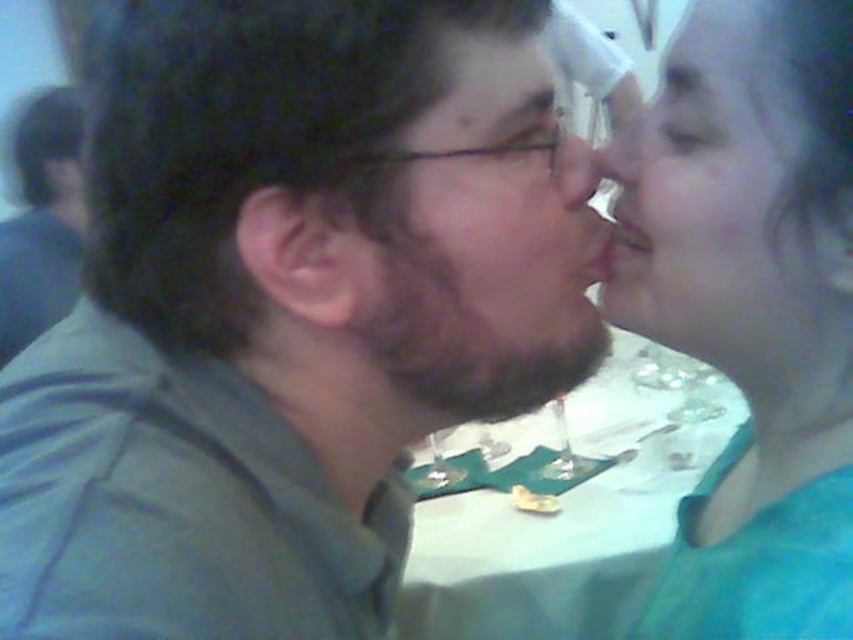
Does matte green shirt at center have a smaller size compared to smooth skin face at upper right?

Incorrect, matte green shirt at center is not smaller in size than smooth skin face at upper right.

Does matte green shirt at center have a greater width compared to smooth skin face at upper right?

Correct, the width of matte green shirt at center exceeds that of smooth skin face at upper right.

Image resolution: width=853 pixels, height=640 pixels. What are the coordinates of `matte green shirt at center` in the screenshot? It's located at (285, 310).

Is brown matte beard at center positioned before smooth skin nose at center?

Yes, it is in front of smooth skin nose at center.

What do you see at coordinates (485, 241) in the screenshot? The width and height of the screenshot is (853, 640). I see `brown matte beard at center` at bounding box center [485, 241].

Where is `brown matte beard at center`? The image size is (853, 640). brown matte beard at center is located at coordinates (485, 241).

Where is `brown matte beard at center`? This screenshot has height=640, width=853. brown matte beard at center is located at coordinates (485, 241).

Can you confirm if smooth teal shirt at right is smaller than smooth skin nose at center?

Actually, smooth teal shirt at right might be larger than smooth skin nose at center.

How much distance is there between smooth teal shirt at right and smooth skin nose at center?

The distance of smooth teal shirt at right from smooth skin nose at center is 2.09 meters.

Between point (732, 227) and point (631, 161), which one is positioned in front?

Point (732, 227)

Identify the location of smooth teal shirt at right. (752, 308).